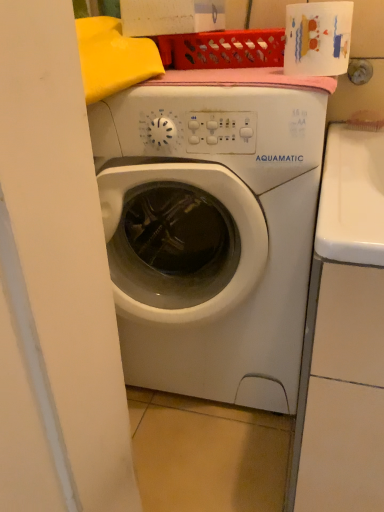
Question: Does white glossy toilet paper at upper right have a lesser width compared to white matte washing machine at center?

Choices:
 (A) no
 (B) yes

Answer: (B)

Question: Can you see white glossy toilet paper at upper right touching white matte washing machine at center?

Choices:
 (A) yes
 (B) no

Answer: (B)

Question: From the image's perspective, is white glossy toilet paper at upper right over white matte washing machine at center?

Choices:
 (A) yes
 (B) no

Answer: (A)

Question: Is white glossy toilet paper at upper right at the left side of white matte washing machine at center?

Choices:
 (A) yes
 (B) no

Answer: (B)

Question: Would you say white glossy toilet paper at upper right is outside white matte washing machine at center?

Choices:
 (A) yes
 (B) no

Answer: (A)

Question: Is white glossy toilet paper at upper right looking in the opposite direction of white matte washing machine at center?

Choices:
 (A) yes
 (B) no

Answer: (B)

Question: Can you see white matte washing machine at center touching white glossy toilet paper at upper right?

Choices:
 (A) yes
 (B) no

Answer: (B)

Question: From a real-world perspective, is white matte washing machine at center located higher than white glossy toilet paper at upper right?

Choices:
 (A) yes
 (B) no

Answer: (B)

Question: Is white glossy toilet paper at upper right a part of white matte washing machine at center?

Choices:
 (A) yes
 (B) no

Answer: (B)

Question: Is white matte washing machine at center taller than white glossy toilet paper at upper right?

Choices:
 (A) no
 (B) yes

Answer: (B)

Question: From the image's perspective, would you say white matte washing machine at center is positioned over white glossy toilet paper at upper right?

Choices:
 (A) yes
 (B) no

Answer: (B)

Question: Can you confirm if white matte washing machine at center is bigger than white glossy toilet paper at upper right?

Choices:
 (A) yes
 (B) no

Answer: (A)

Question: In the image, is white glossy toilet paper at upper right on the left side or the right side of white matte washing machine at center?

Choices:
 (A) right
 (B) left

Answer: (A)